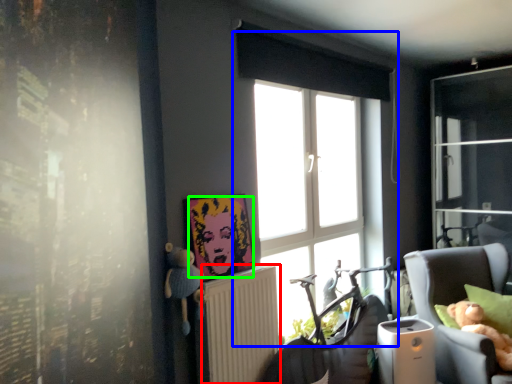
Question: Based on their relative distances, which object is farther from radiator (highlighted by a red box)? Choose from window (highlighted by a blue box) and person (highlighted by a green box).

Choices:
 (A) window
 (B) person

Answer: (A)